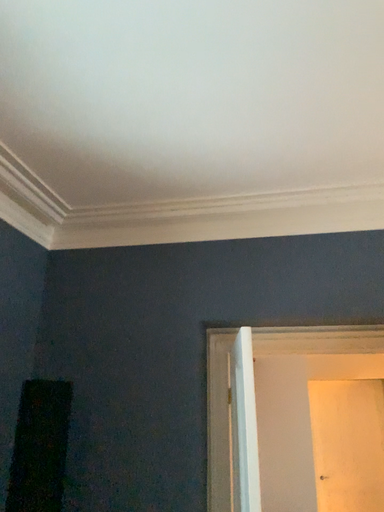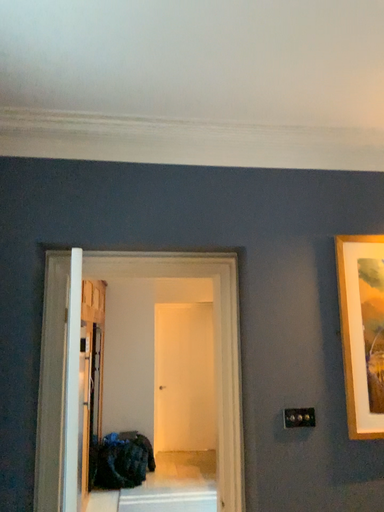
Question: Which way did the camera rotate in the video?

Choices:
 (A) rotated right
 (B) rotated left

Answer: (A)